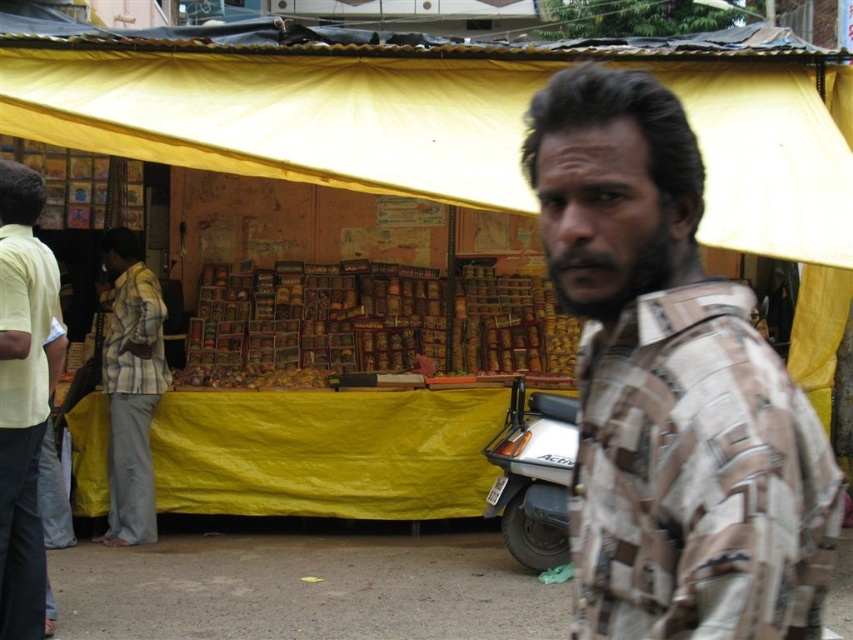
You are a customer at the market and want to approach the stall. There are two people in front of you wearing light yellow shirt at left and striped cotton shirt at left. Which person should you go around to get to the stall?

Answer: The light yellow shirt at left is in front of striped cotton shirt at left, so you should go around the striped cotton shirt at left to reach the stall.

You are a customer at the market and want to approach the stall. There are two people in front of you wearing a light yellow shirt at left and a striped cotton shirt at left. Which person would you ask for assistance if you want to speak to the one who is closer to the stall?

The light yellow shirt at left is closer to the stall because it occupies less space than the striped cotton shirt at left, indicating it is nearer.

You are standing at the entrance of the market stall and want to know if the yellow fabric canopy at upper center can provide shade over the striped cotton shirt at left. Based on their heights, can the canopy cover the shirt?

The yellow fabric canopy at upper center has a lesser height compared to striped cotton shirt at left, so it cannot provide shade over the striped cotton shirt at left because it is shorter than the shirt.